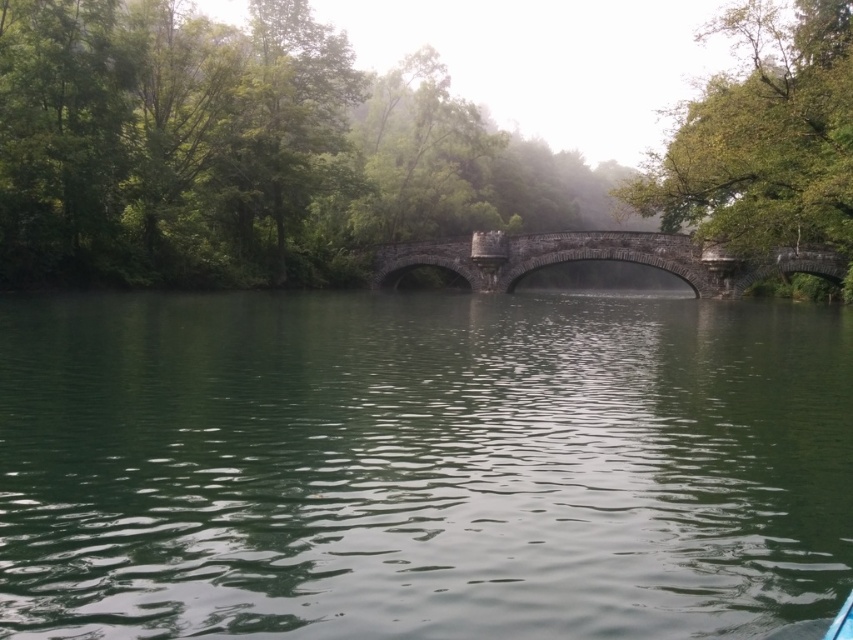
Does green leafy tree at center have a lesser height compared to green leafy tree at upper right?

In fact, green leafy tree at center may be taller than green leafy tree at upper right.

Does point (202, 170) come in front of point (850, 250)?

No, (202, 170) is further to viewer.

This screenshot has width=853, height=640. Identify the location of green leafy tree at center. (370, 147).

Is the position of green smooth water at center less distant than that of green leafy tree at center?

That is True.

Find the location of a particular element. The height and width of the screenshot is (640, 853). green smooth water at center is located at coordinates (421, 465).

Where is `green smooth water at center`? The image size is (853, 640). green smooth water at center is located at coordinates (421, 465).

Which is behind, point (738, 108) or point (553, 252)?

The point (553, 252) is behind.

Does green leafy tree at upper right appear on the left side of dark gray stone bridge at center?

No, green leafy tree at upper right is not to the left of dark gray stone bridge at center.

You are a GUI agent. You are given a task and a screenshot of the screen. Output one action in this format:
    pyautogui.click(x=<x>, y=<y>)
    Task: Click on the green leafy tree at upper right
    The width and height of the screenshot is (853, 640).
    Given the screenshot: What is the action you would take?
    pyautogui.click(x=763, y=136)

At what (x,y) coordinates should I click in order to perform the action: click on green leafy tree at upper right. Please return your answer as a coordinate pair (x, y). Looking at the image, I should click on (763, 136).